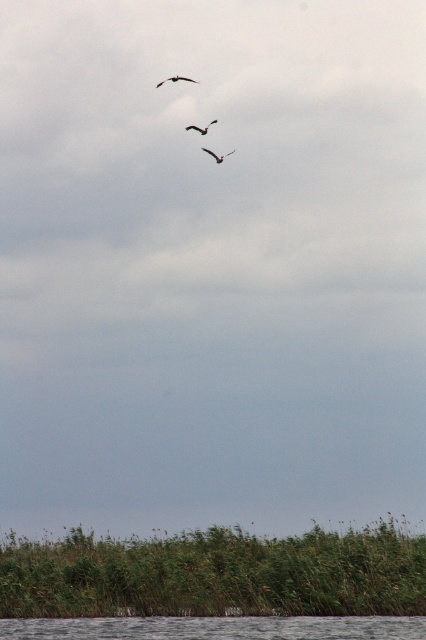
Based on the photo, who is positioned more to the left, dark brown feathered bird at upper center or dark brown feathered bird at center?

dark brown feathered bird at upper center is more to the left.

Measure the distance between dark brown feathered bird at upper center and camera.

dark brown feathered bird at upper center and camera are 44.10 meters apart from each other.

Identify the location of dark brown feathered bird at upper center. (201, 128).

Does dark gray feathered bird at upper center appear on the left side of dark brown feathered bird at center?

Yes, dark gray feathered bird at upper center is to the left of dark brown feathered bird at center.

Does dark gray feathered bird at upper center have a smaller size compared to dark brown feathered bird at center?

No.

In order to click on dark gray feathered bird at upper center in this screenshot , I will do `click(176, 80)`.

Does gray smooth water at lower center lie behind dark brown feathered bird at upper center?

No, it is in front of dark brown feathered bird at upper center.

Is gray smooth water at lower center smaller than dark brown feathered bird at upper center?

No, gray smooth water at lower center is not smaller than dark brown feathered bird at upper center.

Describe the element at coordinates (215, 627) in the screenshot. I see `gray smooth water at lower center` at that location.

At what (x,y) coordinates should I click in order to perform the action: click on gray smooth water at lower center. Please return your answer as a coordinate pair (x, y). This screenshot has width=426, height=640. Looking at the image, I should click on (215, 627).